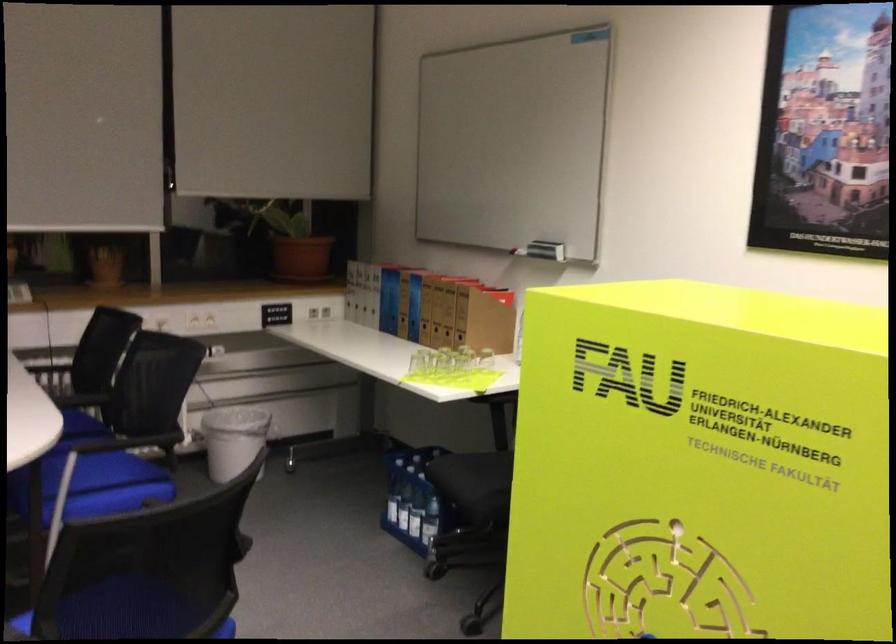
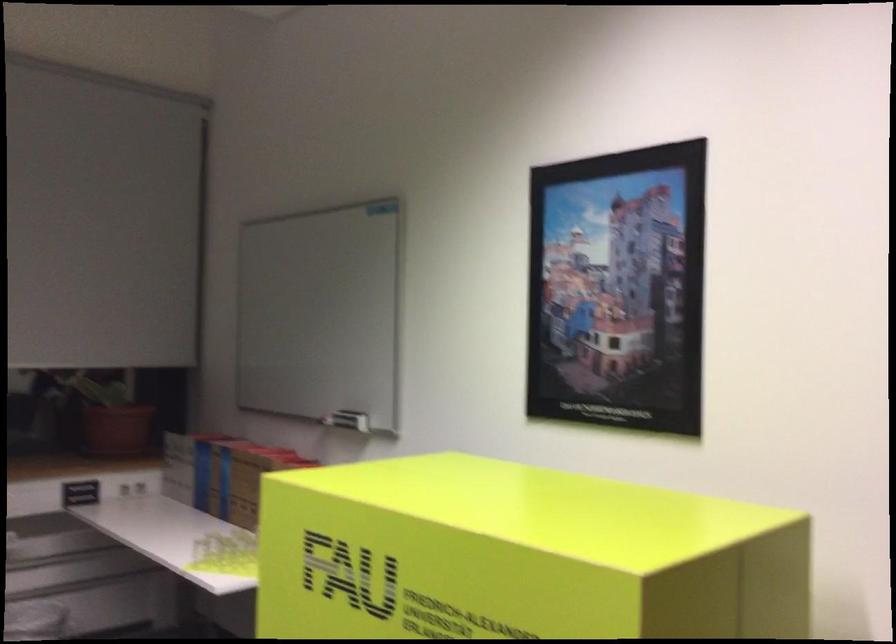
Question: What movement of the cameraman would produce the second image?

Choices:
 (A) Left
 (B) Right
 (C) Forward
 (D) Backward

Answer: (B)